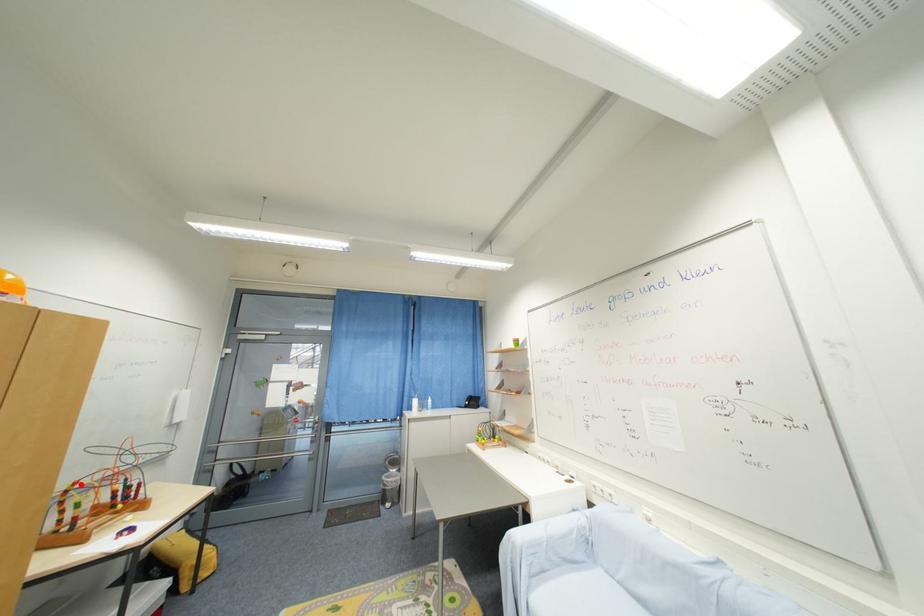
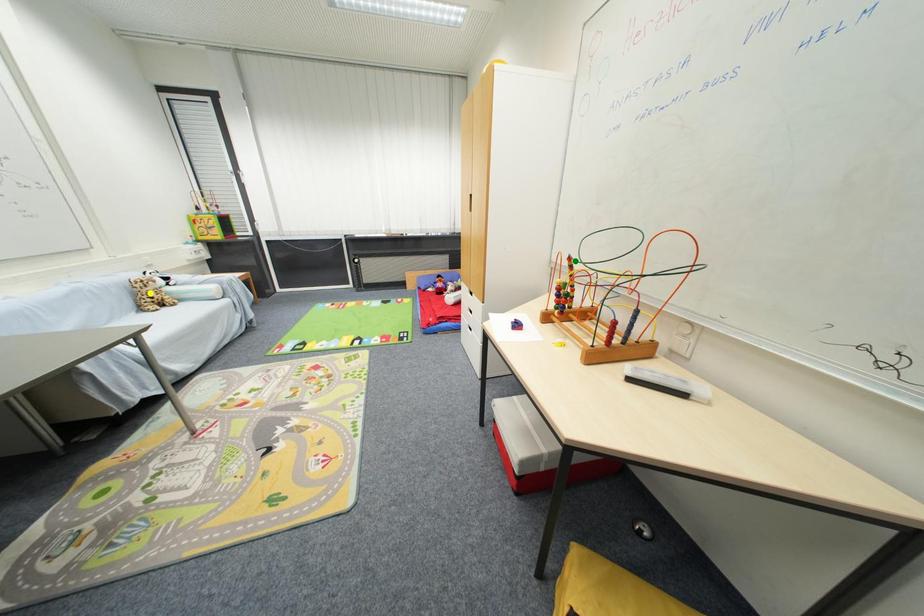
Question: I am providing you with two images of the same scene from different viewpoints. A red point is marked on the first image. You are given multiple points on the second image. In image 2, which mark is for the same physical point as the one in image 1?

Choices:
 (A) blue point
 (B) green point
 (C) yellow point

Answer: (B)